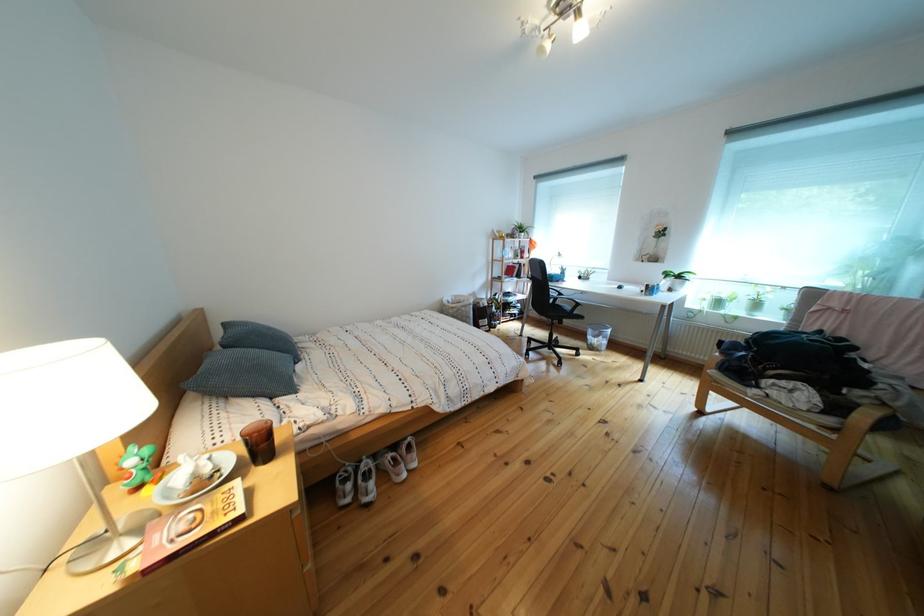
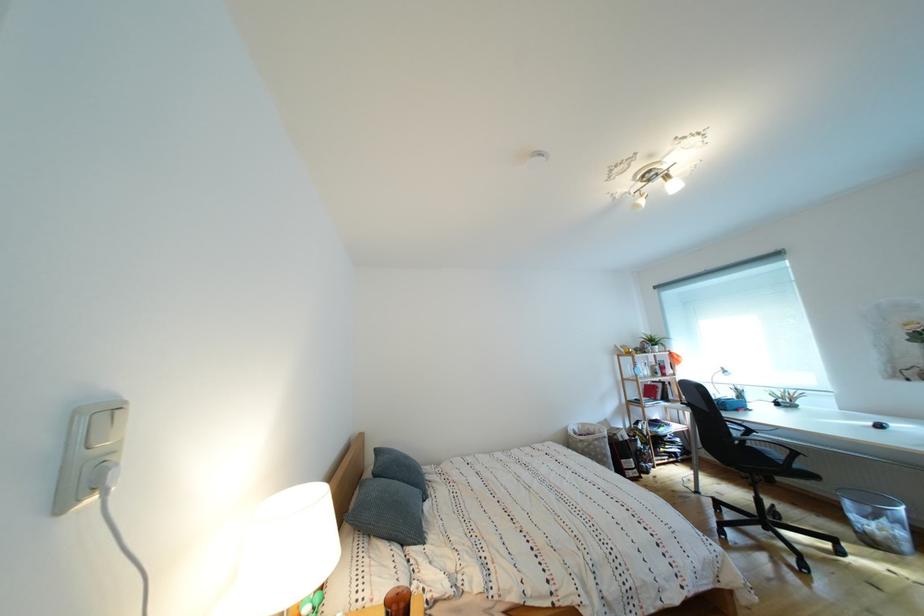
Find the pixel in the second image that matches pixel 566 305 in the first image.

(756, 446)